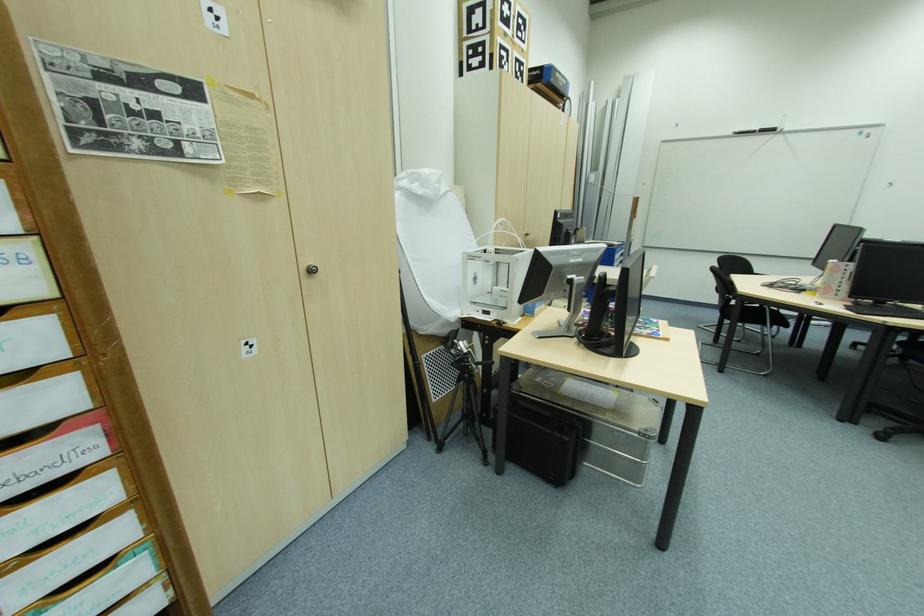
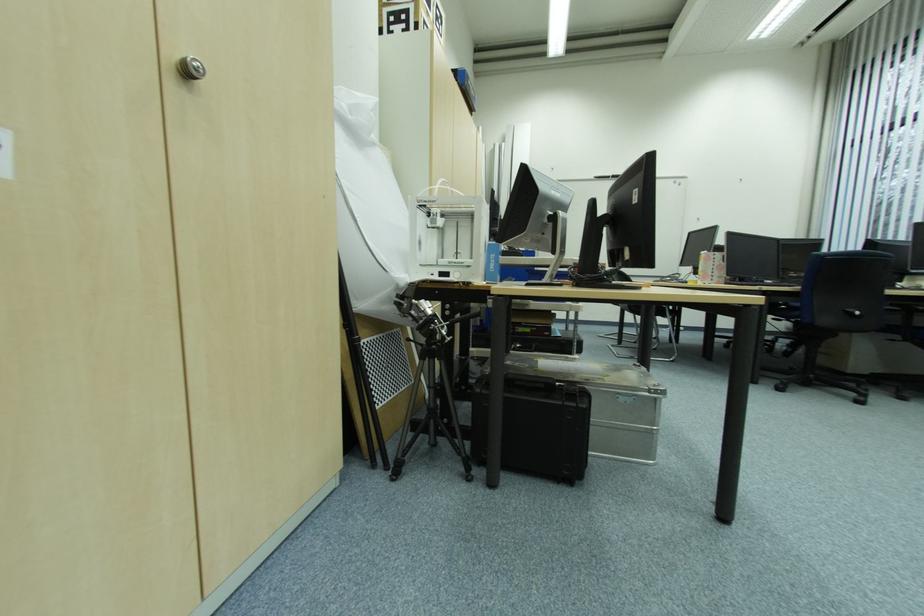
Question: The camera is either moving clockwise (left) or counter-clockwise (right) around the object. The first image is from the beginning of the video and the second image is from the end. Is the camera moving left or right when shooting the video?

Choices:
 (A) Left
 (B) Right

Answer: (A)